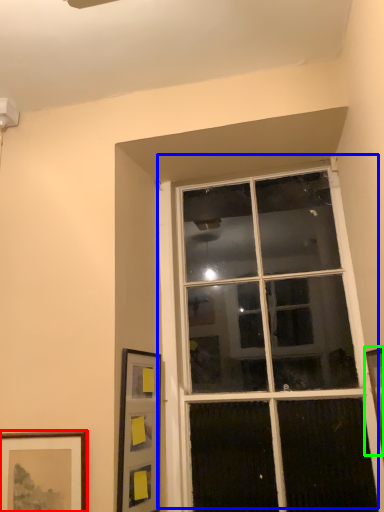
Question: Which object is positioned closest to picture frame (highlighted by a red box)? Select from window (highlighted by a blue box) and picture frame (highlighted by a green box).

Choices:
 (A) window
 (B) picture frame

Answer: (A)